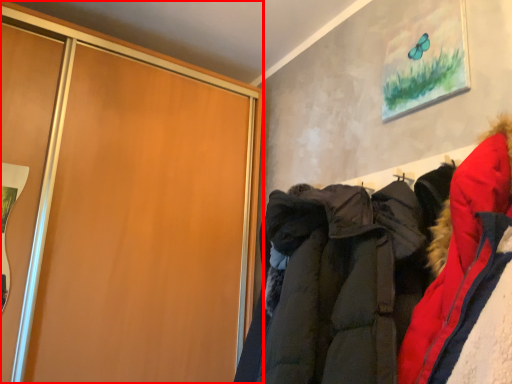
Question: Where is cupboard (annotated by the red box) located in relation to jacket in the image?

Choices:
 (A) right
 (B) left

Answer: (B)